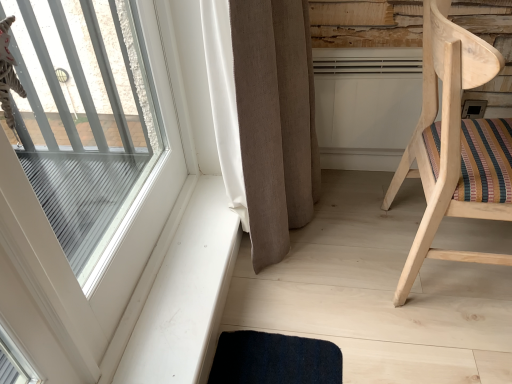
Where is `free space between natural wood chair at right and beige fabric curtain at center`? The height and width of the screenshot is (384, 512). free space between natural wood chair at right and beige fabric curtain at center is located at coordinates (348, 236).